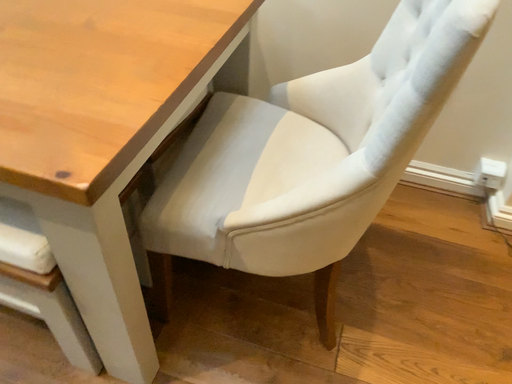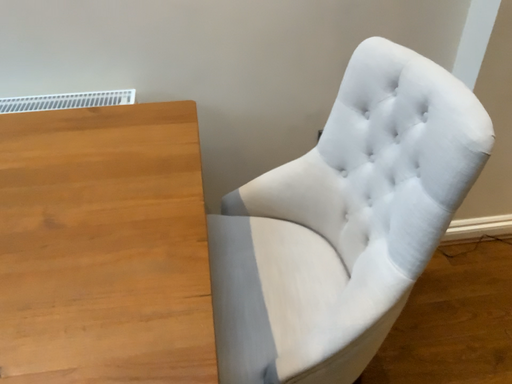
Question: Which way did the camera rotate in the video?

Choices:
 (A) rotated left
 (B) rotated right

Answer: (B)